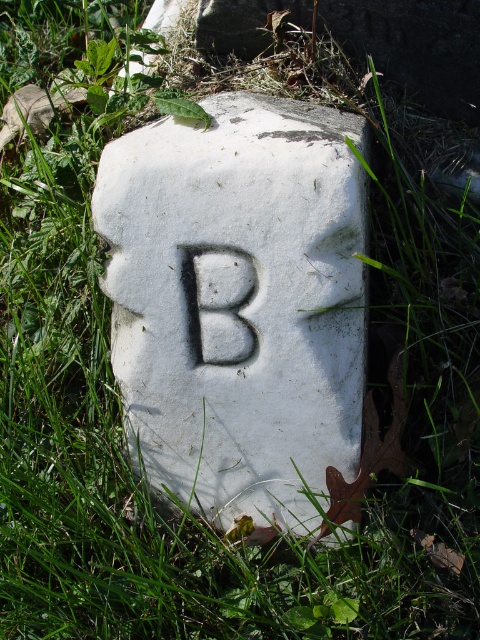
You are standing 1 meter away from the stone marker. Can you reach the point at coordinates point (251, 324) on the stone marker?

The distance of point (251, 324) from the viewer is 1.13 meters, so you are 1 meter away from the stone marker. Since the point is 0.13 meters further away than your current position, you cannot reach it without moving closer.

You are standing in a field and see the white stone at center and the white stone letter b at center. Which object is closer to you?

The white stone at center is closer to the viewer than the white stone letter b at center.